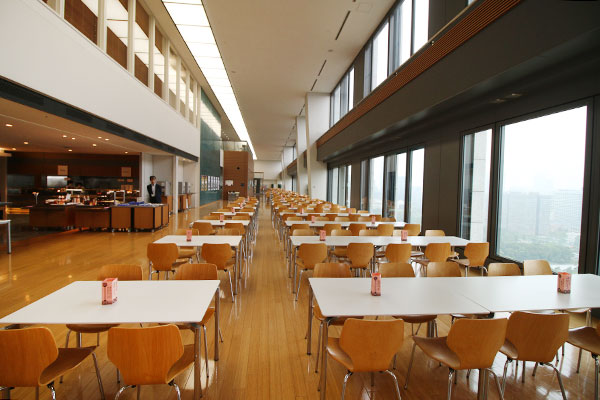
In order to click on upper windows in this screenshot , I will do 420,26, 402,38, 381,54, 351,89, 336,103.